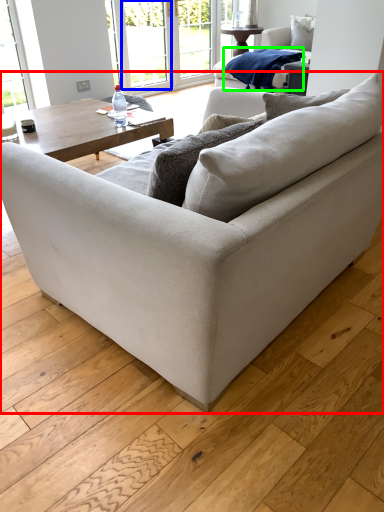
Question: Which object is positioned farthest from studio couch (highlighted by a red box)? Select from window screen (highlighted by a blue box) and material (highlighted by a green box).

Choices:
 (A) window screen
 (B) material

Answer: (A)